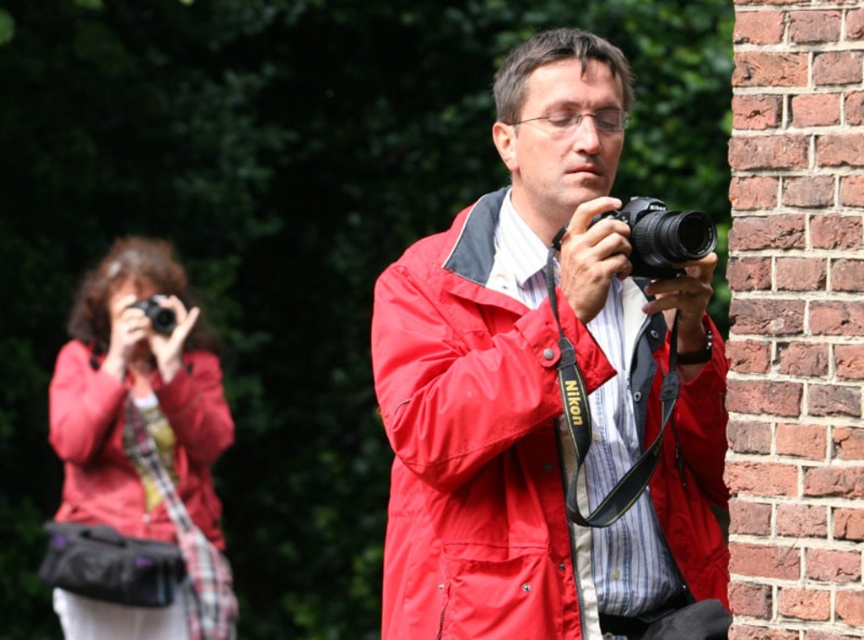
Which is behind, point (380, 400) or point (167, 328)?

Point (167, 328)

Is point (496, 540) less distant than point (175, 321)?

That is True.

Who is more distant from viewer, (678, 518) or (157, 330)?

The point (157, 330) is behind.

This screenshot has width=864, height=640. In order to click on matte nylon jacket at center in this screenshot , I will do `click(474, 448)`.

Does matte black camera at center appear on the right side of black plastic camera at center?

No, matte black camera at center is not to the right of black plastic camera at center.

Does matte black camera at center have a greater width compared to black plastic camera at center?

Correct, the width of matte black camera at center exceeds that of black plastic camera at center.

Between point (164, 579) and point (661, 248), which one is positioned in front?

Positioned in front is point (661, 248).

The width and height of the screenshot is (864, 640). I want to click on matte black camera at center, so click(138, 460).

Does matte black camera at center appear on the left side of black plastic camera at upper left?

Yes, matte black camera at center is to the left of black plastic camera at upper left.

Is point (122, 250) positioned before point (156, 323)?

That is False.

Measure the distance between point (145, 243) and camera.

Point (145, 243) is 7.75 meters away from camera.

I want to click on matte black camera at center, so (x=138, y=460).